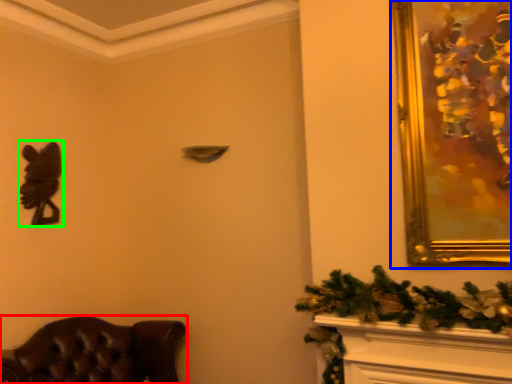
Question: Estimate the real-world distances between objects in this image. Which object is closer to furniture (highlighted by a red box), picture frame (highlighted by a blue box) or animal (highlighted by a green box)?

Choices:
 (A) picture frame
 (B) animal

Answer: (B)